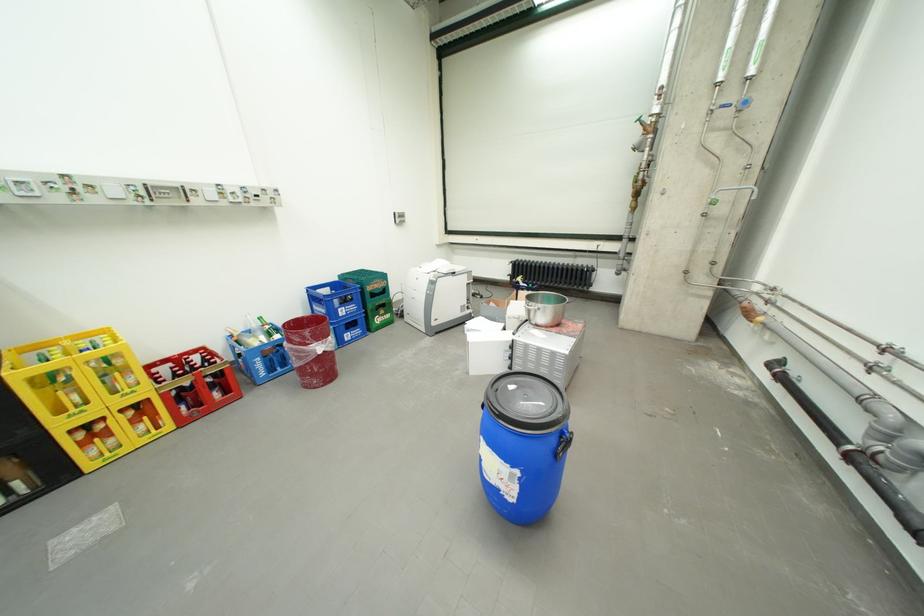
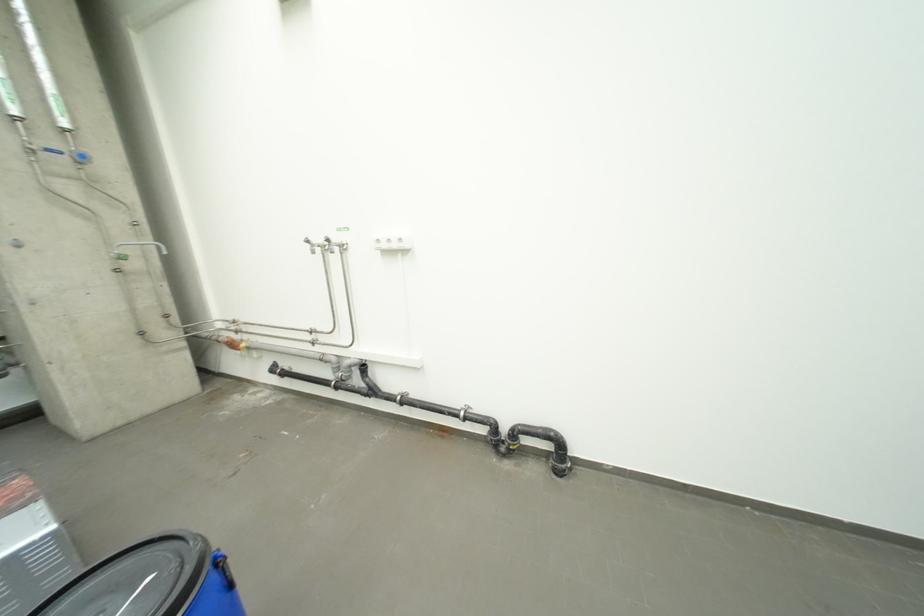
How did the camera likely rotate?

The rotation direction of the camera is right-down.